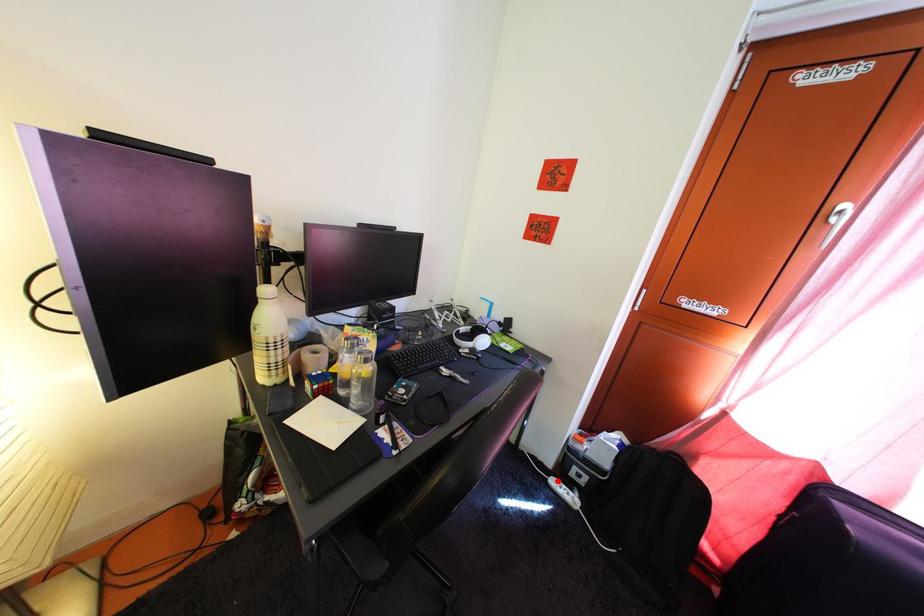
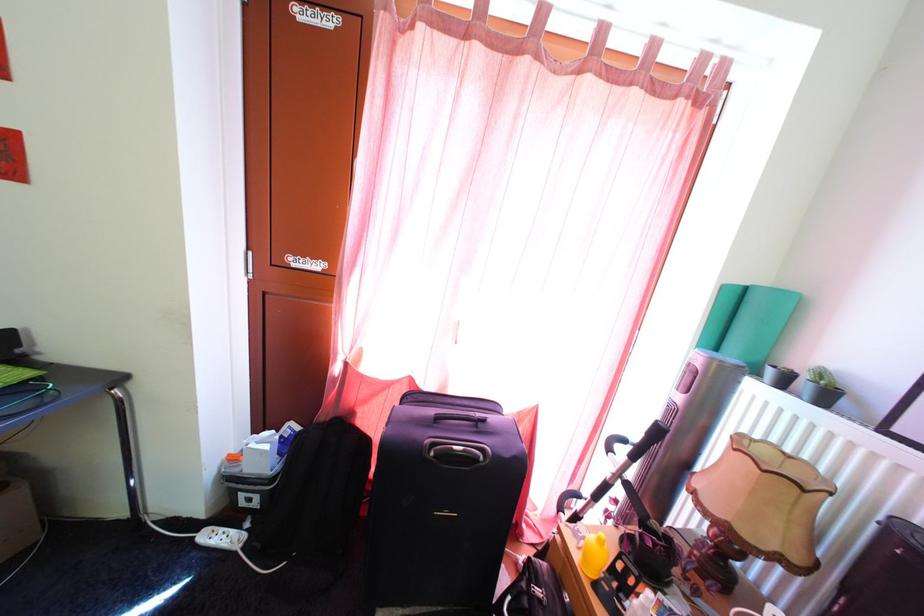
The point at the highlighted location is marked in the first image. Where is the corresponding point in the second image?

(208, 533)